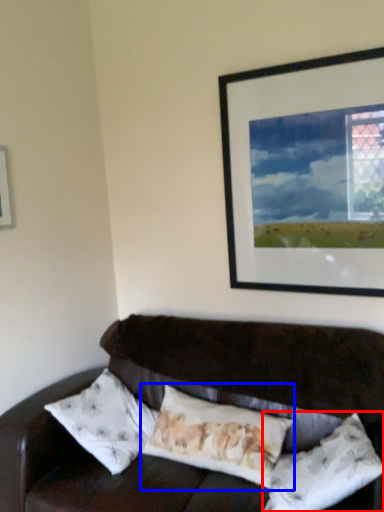
Question: Which object appears closest to the camera in this image, pillow (highlighted by a red box) or pillow (highlighted by a blue box)?

Choices:
 (A) pillow
 (B) pillow

Answer: (A)